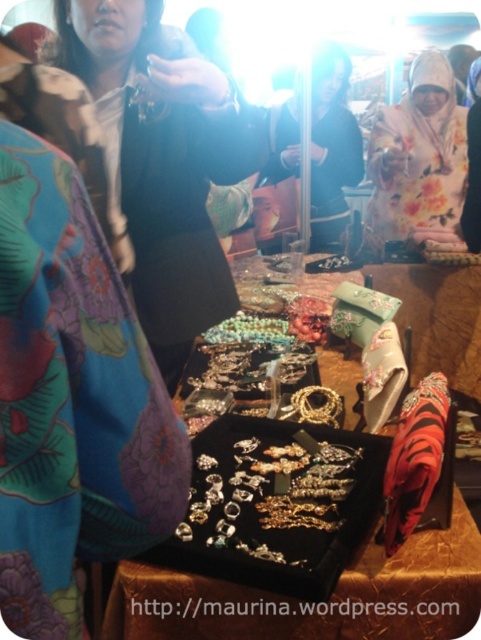
Which is more to the left, silver metallic earrings at center or floral silk scarf at center?

From the viewer's perspective, silver metallic earrings at center appears more on the left side.

Locate an element on the screen. silver metallic earrings at center is located at coordinates (269, 493).

This screenshot has height=640, width=481. Describe the element at coordinates (269, 493) in the screenshot. I see `silver metallic earrings at center` at that location.

Locate an element on the screen. This screenshot has height=640, width=481. silver metallic earrings at center is located at coordinates (269, 493).

Is matte black jacket at center to the right of black velvet jewelry at center from the viewer's perspective?

No, matte black jacket at center is not to the right of black velvet jewelry at center.

Between matte black jacket at center and black velvet jewelry at center, which one is positioned lower?

Positioned lower is black velvet jewelry at center.

Locate an element on the screen. matte black jacket at center is located at coordinates (164, 157).

Locate an element on the screen. matte black jacket at center is located at coordinates (164, 157).

Identify the location of matte black jacket at center. (164, 157).

Does matte black jacket at center appear on the left side of silver metallic earrings at center?

Indeed, matte black jacket at center is positioned on the left side of silver metallic earrings at center.

Between point (129, 65) and point (209, 532), which one is positioned behind?

The point (129, 65) is more distant.

Where is `matte black jacket at center`? matte black jacket at center is located at coordinates (164, 157).